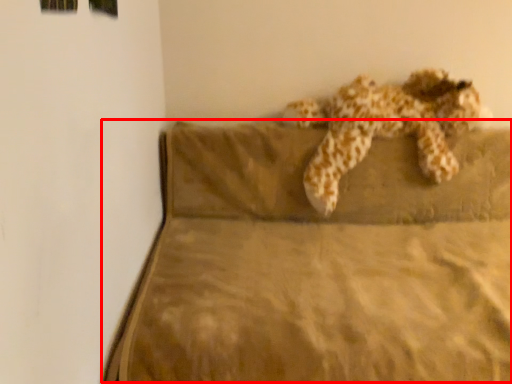
Question: From the image's perspective, what is the correct spatial positioning of mattress (annotated by the red box) in reference to animal?

Choices:
 (A) below
 (B) above

Answer: (A)